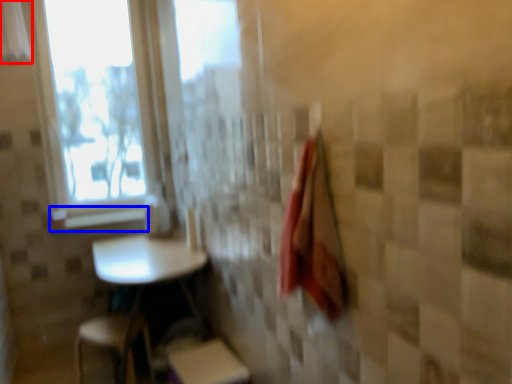
Question: Among these objects, which one is nearest to the camera, curtain (highlighted by a red box) or window sill (highlighted by a blue box)?

Choices:
 (A) curtain
 (B) window sill

Answer: (A)